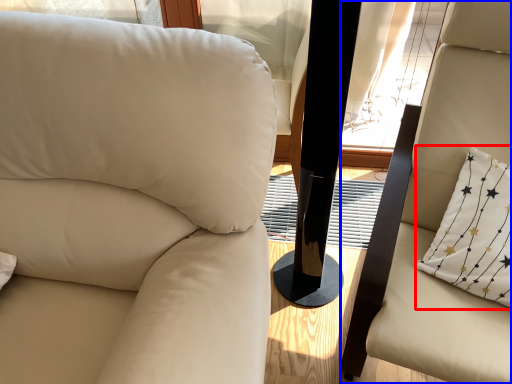
Question: Which point is closer to the camera, pillow (highlighted by a red box) or chair (highlighted by a blue box)?

Choices:
 (A) pillow
 (B) chair

Answer: (B)